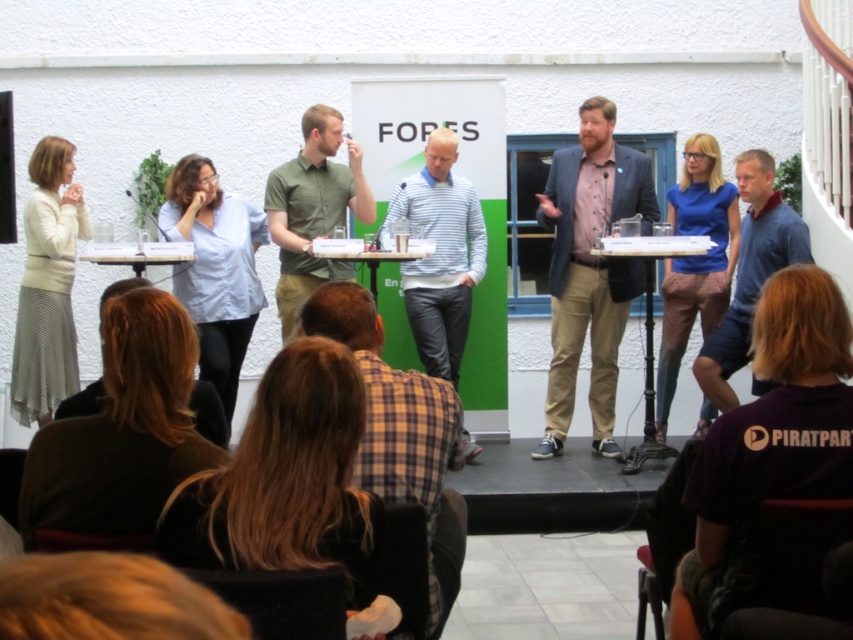
You are an event organizer trying to determine the best camera angle for capturing both the blonde hair at lower center and the matte blue shirt at center. Based on their sizes, which object should you focus on first to ensure both are visible in the frame?

The blonde hair at lower center occupies less space than the matte blue shirt at center, so you should focus on the blonde hair at lower center first to ensure it is visible alongside the larger matte blue shirt at center.

You are an event photographer at the front row. You want to take a photo of the panelist with the blonde hair at lower center and the matte blue shirt at center. Which object is narrower in your camera frame?

The blonde hair at lower center is narrower than the matte blue shirt at center in the camera frame.